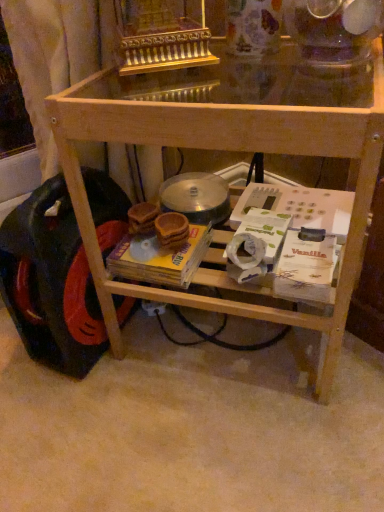
You are a GUI agent. You are given a task and a screenshot of the screen. Output one action in this format:
    pyautogui.click(x=<x>, y=<y>)
    Task: Click on the natural wood table at center
    
    Given the screenshot: What is the action you would take?
    pyautogui.click(x=232, y=151)

Does natural wood table at center have a smaller size compared to black rubber wheel at lower left?

Actually, natural wood table at center might be larger than black rubber wheel at lower left.

Which is behind, point (321, 137) or point (46, 250)?

Positioned behind is point (46, 250).

Is natural wood table at center inside or outside of black rubber wheel at lower left?

natural wood table at center is spatially situated outside black rubber wheel at lower left.

Is yellow cardboard magazine at center in front of or behind black rubber wheel at lower left in the image?

Visually, yellow cardboard magazine at center is located behind black rubber wheel at lower left.

Based on the photo, is yellow cardboard magazine at center inside the boundaries of black rubber wheel at lower left, or outside?

yellow cardboard magazine at center exists outside the volume of black rubber wheel at lower left.

Is yellow cardboard magazine at center positioned with its back to black rubber wheel at lower left?

No, yellow cardboard magazine at center's orientation is not away from black rubber wheel at lower left.

How many degrees apart are the facing directions of yellow cardboard magazine at center and black rubber wheel at lower left?

There is a 82.4-degree angle between the facing directions of yellow cardboard magazine at center and black rubber wheel at lower left.

In the scene shown: Can we say black rubber wheel at lower left lies outside yellow cardboard magazine at center?

Absolutely, black rubber wheel at lower left is external to yellow cardboard magazine at center.

Is black rubber wheel at lower left with yellow cardboard magazine at center?

No, black rubber wheel at lower left is not with yellow cardboard magazine at center.

Which is further, (42, 269) or (198, 266)?

Positioned behind is point (198, 266).

In terms of size, does black rubber wheel at lower left appear bigger or smaller than yellow cardboard magazine at center?

Considering their sizes, black rubber wheel at lower left takes up more space than yellow cardboard magazine at center.

Which object is further away from the camera taking this photo, black rubber wheel at lower left or natural wood table at center?

black rubber wheel at lower left.

Locate an element on the screen. table on the right of the black rubber wheel at lower left is located at coordinates (232, 151).

Is black rubber wheel at lower left wider or thinner than natural wood table at center?

Considering their sizes, black rubber wheel at lower left looks slimmer than natural wood table at center.

Which of these two, natural wood table at center or yellow cardboard magazine at center, stands shorter?

yellow cardboard magazine at center is shorter.

What are the coordinates of `magazine located behind the natural wood table at center` in the screenshot? It's located at [160, 258].

From the image's perspective, is natural wood table at center located beneath yellow cardboard magazine at center?

No.

From the image's perspective, is yellow cardboard magazine at center beneath natural wood table at center?

Yes, from the image's perspective, yellow cardboard magazine at center is below natural wood table at center.

Who is taller, yellow cardboard magazine at center or natural wood table at center?

natural wood table at center.

Is yellow cardboard magazine at center inside the boundaries of natural wood table at center, or outside?

yellow cardboard magazine at center is enclosed within natural wood table at center.

What's the angular difference between yellow cardboard magazine at center and natural wood table at center's facing directions?

There is a 2.3-degree angle between the facing directions of yellow cardboard magazine at center and natural wood table at center.

Where is `wheel on the left side of natural wood table at center`? wheel on the left side of natural wood table at center is located at coordinates (51, 283).

You are a GUI agent. You are given a task and a screenshot of the screen. Output one action in this format:
    pyautogui.click(x=<x>, y=<y>)
    Task: Click on the magazine that appears above the black rubber wheel at lower left (from a real-world perspective)
    The height and width of the screenshot is (512, 384).
    Given the screenshot: What is the action you would take?
    pyautogui.click(x=160, y=258)

Estimate the real-world distances between objects in this image. Which object is further from yellow cardboard magazine at center, natural wood table at center or black rubber wheel at lower left?

natural wood table at center lies further to yellow cardboard magazine at center than the other object.

Based on their spatial positions, is black rubber wheel at lower left or yellow cardboard magazine at center further from natural wood table at center?

Based on the image, yellow cardboard magazine at center appears to be further to natural wood table at center.

Looking at this image, estimate the real-world distances between objects in this image. Which object is closer to black rubber wheel at lower left, natural wood table at center or yellow cardboard magazine at center?

yellow cardboard magazine at center.

Looking at the image, which one is located further to black rubber wheel at lower left, yellow cardboard magazine at center or natural wood table at center?

natural wood table at center lies further to black rubber wheel at lower left than the other object.

From the picture: Which object lies nearer to the anchor point natural wood table at center, yellow cardboard magazine at center or black rubber wheel at lower left?

Among the two, black rubber wheel at lower left is located nearer to natural wood table at center.

Looking at this image, looking at the image, which one is located closer to yellow cardboard magazine at center, black rubber wheel at lower left or natural wood table at center?

black rubber wheel at lower left.

You are a GUI agent. You are given a task and a screenshot of the screen. Output one action in this format:
    pyautogui.click(x=<x>, y=<y>)
    Task: Click on the magazine between black rubber wheel at lower left and natural wood table at center
    This screenshot has height=512, width=384.
    Given the screenshot: What is the action you would take?
    pyautogui.click(x=160, y=258)